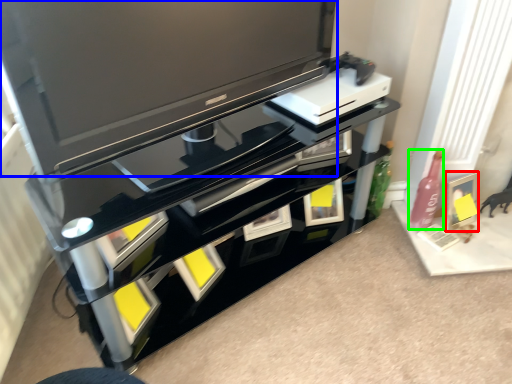
Question: Considering the real-world distances, which object is closest to picture frame (highlighted by a red box)? television (highlighted by a blue box) or bottle (highlighted by a green box).

Choices:
 (A) television
 (B) bottle

Answer: (B)